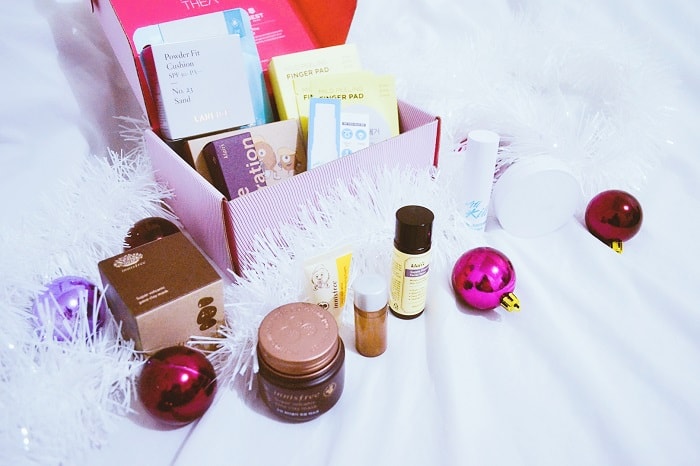
You are a GUI agent. You are given a task and a screenshot of the screen. Output one action in this format:
    pyautogui.click(x=<x>, y=<y>)
    Task: Click on the copper colored screw-on lid
    This screenshot has height=466, width=700.
    Given the screenshot: What is the action you would take?
    pyautogui.click(x=285, y=332), pyautogui.click(x=279, y=303)